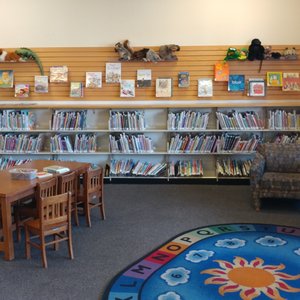
Locate an element on the screen. blue book on display is located at coordinates point(235,83).